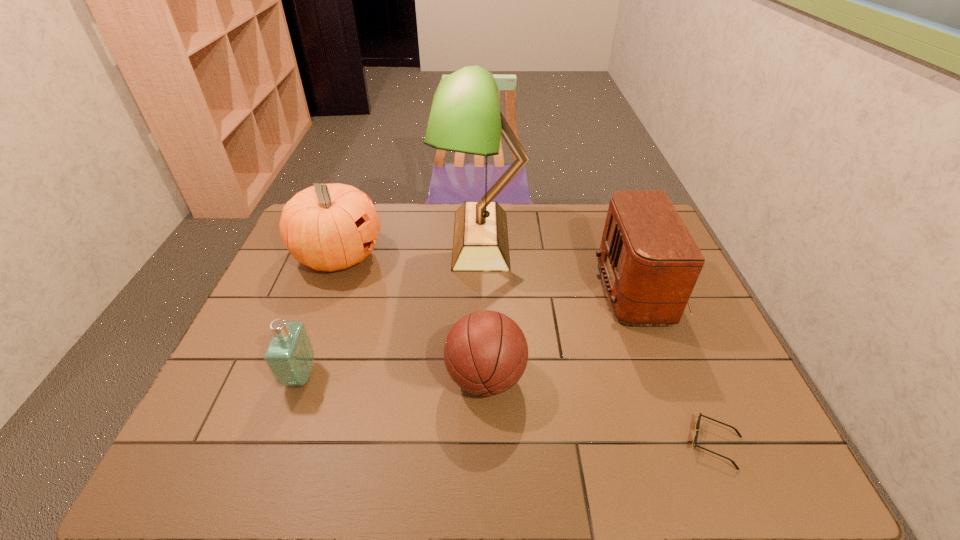
Where is `object that stands as the fifth closest to the perfume`? This screenshot has height=540, width=960. object that stands as the fifth closest to the perfume is located at coordinates (699, 417).

The height and width of the screenshot is (540, 960). I want to click on vacant space that satisfies the following two spatial constraints: 1. on the metallic stand of the table lamp; 2. on the left side of the basketball, so click(x=481, y=377).

The width and height of the screenshot is (960, 540). Identify the location of free space that satisfies the following two spatial constraints: 1. on the front-facing side of the pumpkin; 2. on the left side of the basketball. (293, 377).

The height and width of the screenshot is (540, 960). I want to click on free space that satisfies the following two spatial constraints: 1. on the front-facing side of the basketball; 2. on the right side of the pumpkin, so [293, 377].

Identify the location of vacant space that satisfies the following two spatial constraints: 1. on the front panel of the radio receiver; 2. on the front side of the basketball. (682, 377).

Where is `blank space that satisfies the following two spatial constraints: 1. on the metallic stand of the tallest object; 2. on the left side of the basketball`? The image size is (960, 540). blank space that satisfies the following two spatial constraints: 1. on the metallic stand of the tallest object; 2. on the left side of the basketball is located at coordinates (481, 377).

Identify the location of free spot that satisfies the following two spatial constraints: 1. on the front label of the perfume; 2. on the back side of the basketball. The width and height of the screenshot is (960, 540). (300, 377).